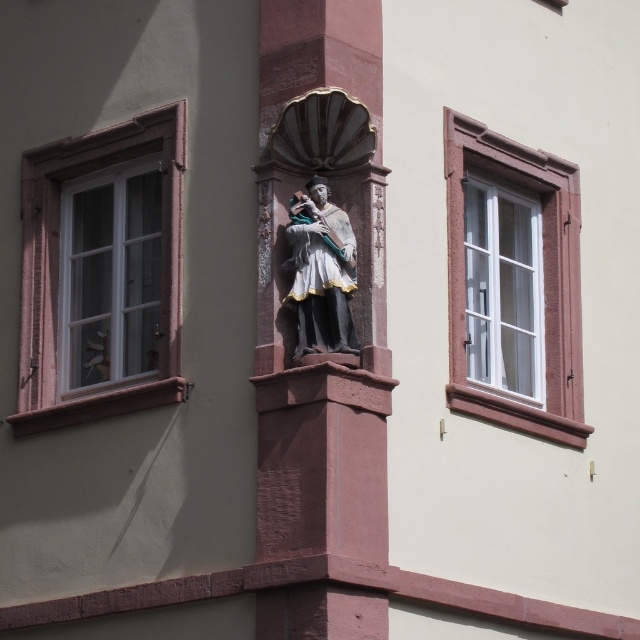
Question: Can you confirm if white glass window at right is positioned above polished bronze statue at center?

Choices:
 (A) no
 (B) yes

Answer: (A)

Question: Is white wood window at left bigger than white glass window at right?

Choices:
 (A) yes
 (B) no

Answer: (A)

Question: Which point appears closest to the camera in this image?

Choices:
 (A) (564, 397)
 (B) (20, 410)

Answer: (B)

Question: Which of these objects is positioned closest to the white glass window at right?

Choices:
 (A) polished bronze statue at center
 (B) white wood window at left

Answer: (A)

Question: Estimate the real-world distances between objects in this image. Which object is closer to the white glass window at right?

Choices:
 (A) polished bronze statue at center
 (B) white wood window at left

Answer: (A)

Question: Considering the relative positions of white wood window at left and white glass window at right in the image provided, where is white wood window at left located with respect to white glass window at right?

Choices:
 (A) left
 (B) right

Answer: (A)